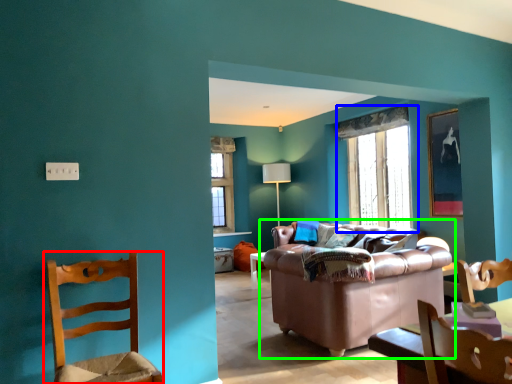
Question: Which object is positioned closest to chair (highlighted by a red box)? Select from window (highlighted by a blue box) and studio couch (highlighted by a green box).

Choices:
 (A) window
 (B) studio couch

Answer: (B)